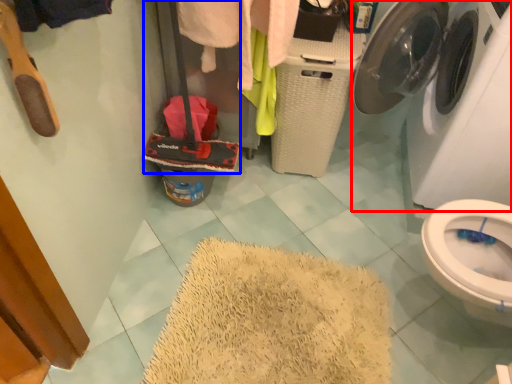
Question: Which object is closer to the camera taking this photo, washing machine (highlighted by a red box) or luggage (highlighted by a blue box)?

Choices:
 (A) washing machine
 (B) luggage

Answer: (A)